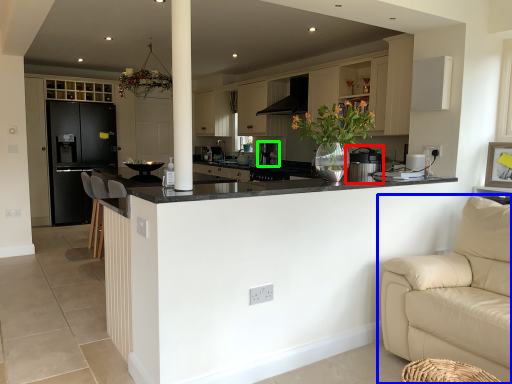
Question: Based on their relative distances, which object is farther from appliance (highlighted by a red box)? Choose from studio couch (highlighted by a blue box) and coffee machine (highlighted by a green box).

Choices:
 (A) studio couch
 (B) coffee machine

Answer: (B)